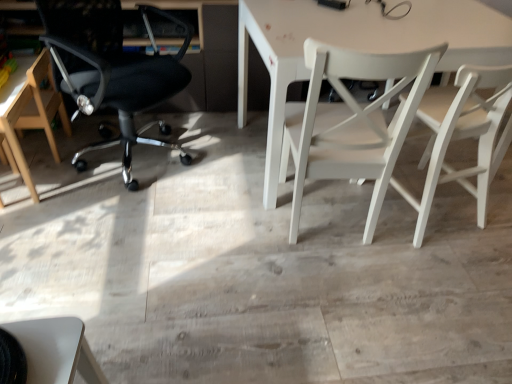
Locate an element on the screen. The image size is (512, 384). free space to the right of light brown wooden chair at left, marked as the fourth chair in a right-to-left arrangement is located at coordinates (84, 188).